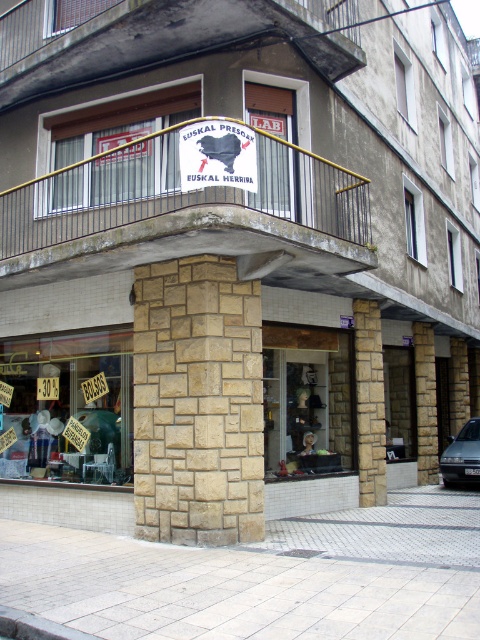
Question: Where is white brick pavement at lower center located in relation to natural stone column at center in the image?

Choices:
 (A) right
 (B) left

Answer: (A)

Question: Among these points, which one is farthest from the camera?

Choices:
 (A) (356, 323)
 (B) (381, 598)
 (C) (436, 436)

Answer: (C)

Question: Which object appears closest to the camera in this image?

Choices:
 (A) matte black sign at upper center
 (B) natural stone column at center
 (C) white brick pavement at lower center

Answer: (C)

Question: Can you confirm if matte glass shop window at lower left is positioned above brown stone pillar at center?

Choices:
 (A) yes
 (B) no

Answer: (A)

Question: From the image, what is the correct spatial relationship of natural stone column at center in relation to brown stone pillar at center?

Choices:
 (A) left
 (B) right

Answer: (A)

Question: Among these objects, which one is nearest to the camera?

Choices:
 (A) brown stone pillar at center
 (B) matte black sign at upper center

Answer: (B)